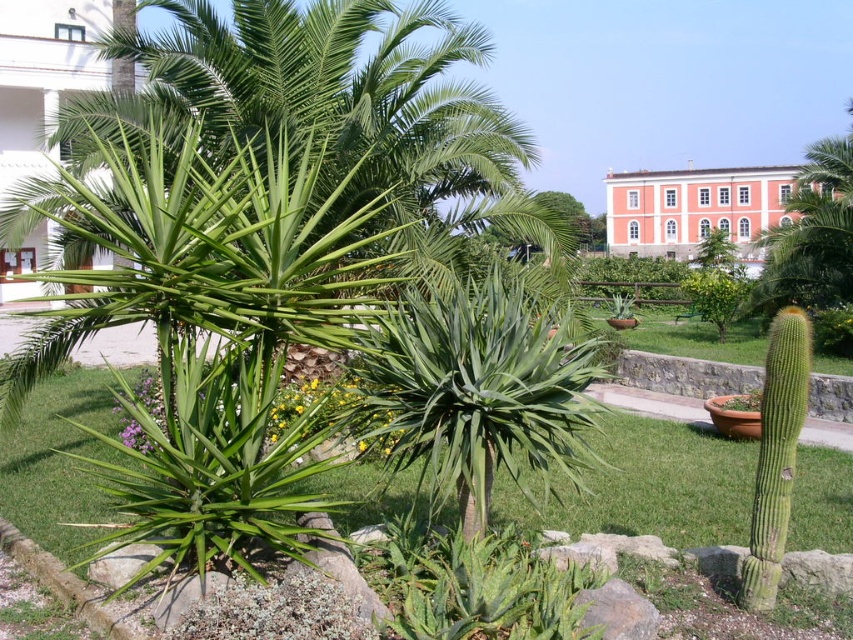
Between green leafy palm tree at center and pink stucco building at upper center, which one is positioned lower?

green leafy palm tree at center

Is green leafy palm tree at center taller than pink stucco building at upper center?

No.

Is point (492, 468) more distant than point (709, 221)?

No, it is in front of (709, 221).

Locate an element on the screen. The image size is (853, 640). green leafy palm tree at center is located at coordinates (477, 388).